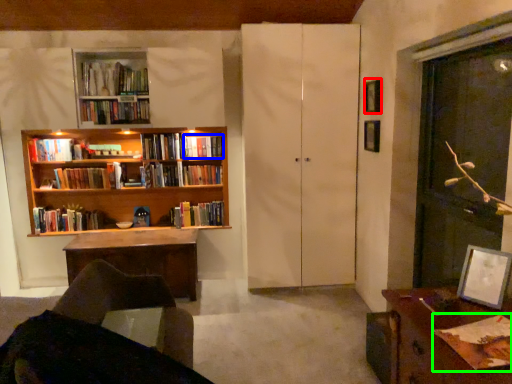
Question: Estimate the real-world distances between objects in this image. Which object is closer to picture frame (highlighted by a red box), book (highlighted by a blue box) or book (highlighted by a green box)?

Choices:
 (A) book
 (B) book

Answer: (A)